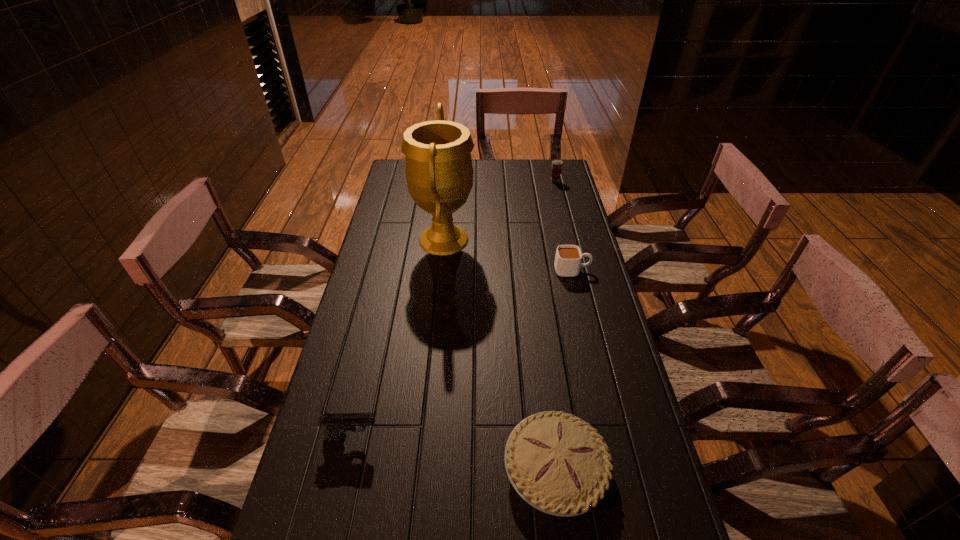
This screenshot has width=960, height=540. I want to click on unoccupied area between the pie and the pistol, so click(454, 453).

Where is `free space between the trophy and the pistol`? The height and width of the screenshot is (540, 960). free space between the trophy and the pistol is located at coordinates (397, 338).

At what (x,y) coordinates should I click in order to perform the action: click on free space between the pistol and the tallest object. Please return your answer as a coordinate pair (x, y). This screenshot has height=540, width=960. Looking at the image, I should click on (397, 338).

Find the location of a particular element. vacant region between the farthest object and the pistol is located at coordinates (453, 309).

Locate an element on the screen. This screenshot has height=540, width=960. vacant region between the shorter cup and the pistol is located at coordinates (462, 353).

Identify the location of blank region between the tallest object and the farther cup. The height and width of the screenshot is (540, 960). (499, 211).

Locate an element on the screen. Image resolution: width=960 pixels, height=540 pixels. the third closest object to the shorter cup is located at coordinates (557, 164).

Point out which object is positioned as the nearest to the tallest object. Please provide its 2D coordinates. Your answer should be formatted as a tuple, i.e. [(x, y)], where the tuple contains the x and y coordinates of a point satisfying the conditions above.

[(568, 258)]

This screenshot has width=960, height=540. In order to click on free spot that satisfies the following two spatial constraints: 1. on the engravings side of the trophy; 2. on the left side of the pie in this screenshot , I will do `click(420, 470)`.

This screenshot has width=960, height=540. I want to click on free space that satisfies the following two spatial constraints: 1. on the engravings side of the tallest object; 2. on the left side of the pie, so click(x=420, y=470).